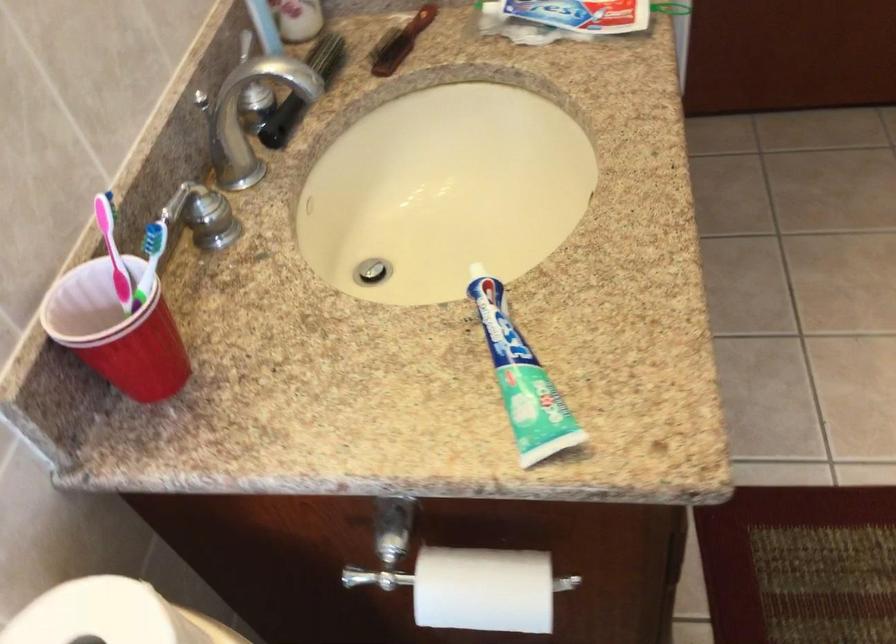
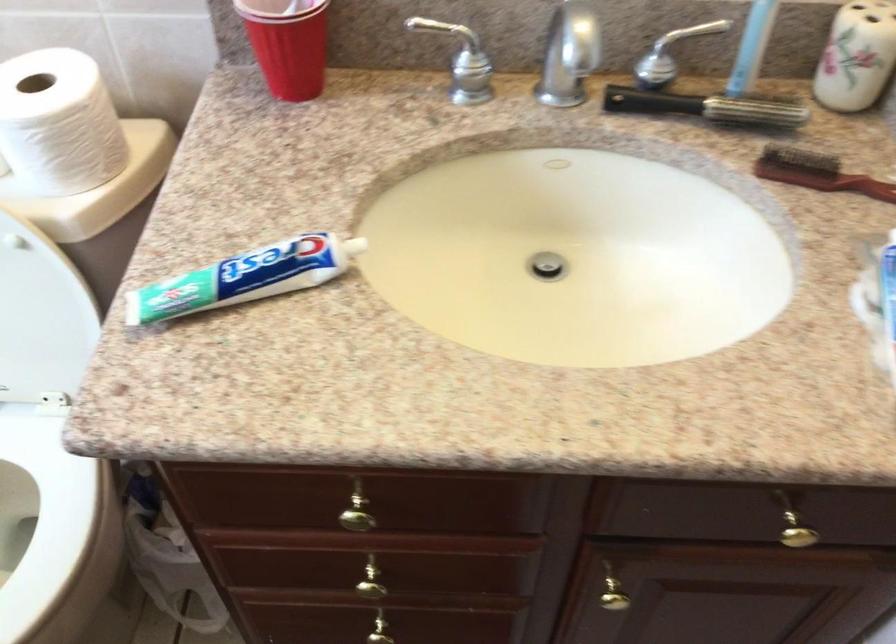
In the second image, find the point that corresponds to the point at 159,223 in the first image.

(455, 44)